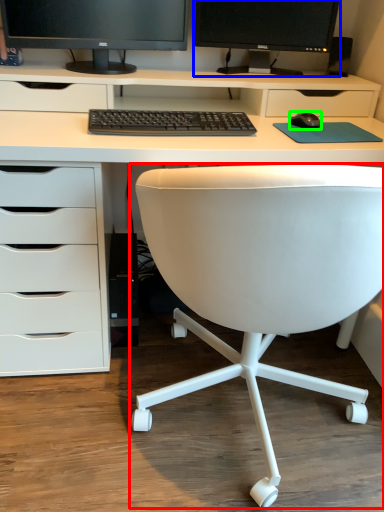
Question: Considering the real-world distances, which object is closest to chair (highlighted by a red box)? computer monitor (highlighted by a blue box) or office supplies (highlighted by a green box).

Choices:
 (A) computer monitor
 (B) office supplies

Answer: (B)